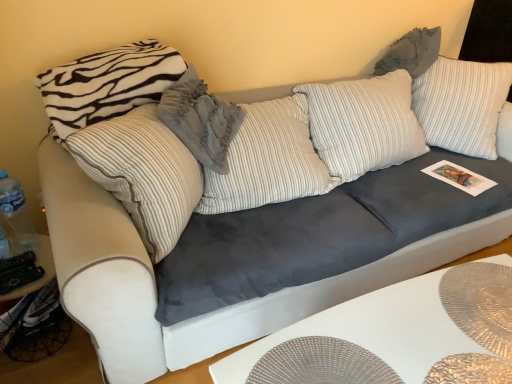
Question: Is gray textured pillow at upper right, placed as the 1th pillow when sorted from right to left, taller than white striped pillow at upper left, which is the 1th pillow in left-to-right order?

Choices:
 (A) yes
 (B) no

Answer: (B)

Question: From the image's perspective, would you say gray textured pillow at upper right, which is counted as the third pillow, starting from the left, is positioned over white striped pillow at upper left, which is the 1th pillow in left-to-right order?

Choices:
 (A) yes
 (B) no

Answer: (A)

Question: Is gray textured pillow at upper right, which is counted as the third pillow, starting from the left, to the right of white striped pillow at upper left, positioned as the 3th pillow in right-to-left order, from the viewer's perspective?

Choices:
 (A) yes
 (B) no

Answer: (A)

Question: Can you confirm if gray textured pillow at upper right, which is counted as the third pillow, starting from the left, is thinner than white striped pillow at upper left, which is the 1th pillow in left-to-right order?

Choices:
 (A) no
 (B) yes

Answer: (A)

Question: Is gray textured pillow at upper right, placed as the 1th pillow when sorted from right to left, facing towards white striped pillow at upper left, positioned as the 3th pillow in right-to-left order?

Choices:
 (A) no
 (B) yes

Answer: (A)

Question: Is white striped pillow at upper left, positioned as the 3th pillow in right-to-left order, in front of or behind velvety gray pillow at center, marked as the 2th pillow in a left-to-right arrangement, in the image?

Choices:
 (A) behind
 (B) front

Answer: (A)

Question: From a real-world perspective, is white striped pillow at upper left, which is the 1th pillow in left-to-right order, physically located above or below velvety gray pillow at center, placed as the second pillow when sorted from right to left?

Choices:
 (A) below
 (B) above

Answer: (B)

Question: Does point (134, 48) appear closer or farther from the camera than point (194, 119)?

Choices:
 (A) farther
 (B) closer

Answer: (A)

Question: Based on their sizes in the image, would you say white striped pillow at upper left, which is the 1th pillow in left-to-right order, is bigger or smaller than velvety gray pillow at center, placed as the second pillow when sorted from right to left?

Choices:
 (A) big
 (B) small

Answer: (B)

Question: From a real-world perspective, is gray textured pillow at upper right, placed as the 1th pillow when sorted from right to left, above or below velvety gray pillow at center, placed as the second pillow when sorted from right to left?

Choices:
 (A) below
 (B) above

Answer: (B)

Question: From the image's perspective, is gray textured pillow at upper right, placed as the 1th pillow when sorted from right to left, located above or below velvety gray pillow at center, marked as the 2th pillow in a left-to-right arrangement?

Choices:
 (A) above
 (B) below

Answer: (A)

Question: Based on their positions, is gray textured pillow at upper right, placed as the 1th pillow when sorted from right to left, located to the left or right of velvety gray pillow at center, marked as the 2th pillow in a left-to-right arrangement?

Choices:
 (A) left
 (B) right

Answer: (B)

Question: Looking at the image, does gray textured pillow at upper right, placed as the 1th pillow when sorted from right to left, seem bigger or smaller compared to velvety gray pillow at center, marked as the 2th pillow in a left-to-right arrangement?

Choices:
 (A) big
 (B) small

Answer: (B)

Question: Is velvety gray pillow at center, placed as the second pillow when sorted from right to left, wider or thinner than gray textured pillow at upper right, which is counted as the third pillow, starting from the left?

Choices:
 (A) wide
 (B) thin

Answer: (A)

Question: Considering the positions of velvety gray pillow at center, marked as the 2th pillow in a left-to-right arrangement, and gray textured pillow at upper right, which is counted as the third pillow, starting from the left, in the image, is velvety gray pillow at center, marked as the 2th pillow in a left-to-right arrangement, taller or shorter than gray textured pillow at upper right, which is counted as the third pillow, starting from the left,?

Choices:
 (A) short
 (B) tall

Answer: (B)